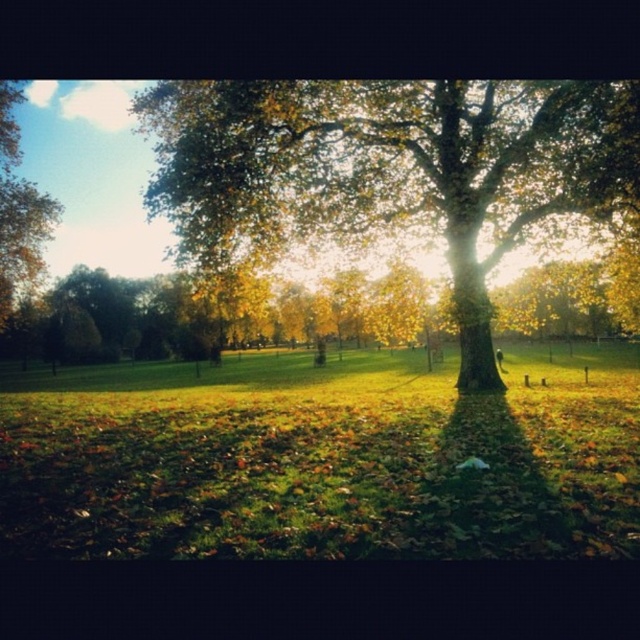
Who is lower down, green grass at center or golden textured tree at center?

Positioned lower is green grass at center.

Between green grass at center and golden textured tree at center, which one appears on the right side from the viewer's perspective?

golden textured tree at center is more to the right.

Does point (129, 435) come in front of point (486, 156)?

Yes, it is in front of point (486, 156).

Identify the location of green grass at center. The height and width of the screenshot is (640, 640). (321, 458).

Who is higher up, green grass at center or green leafy tree at upper left?

green leafy tree at upper left is above.

This screenshot has height=640, width=640. What do you see at coordinates (321, 458) in the screenshot? I see `green grass at center` at bounding box center [321, 458].

Find the location of `green grass at center`. green grass at center is located at coordinates (321, 458).

The height and width of the screenshot is (640, 640). Identify the location of green grass at center. (321, 458).

Does golden textured tree at center appear on the right side of green leafy tree at upper left?

Indeed, golden textured tree at center is positioned on the right side of green leafy tree at upper left.

Based on the photo, can you confirm if golden textured tree at center is positioned below green leafy tree at upper left?

Yes.

Which is behind, point (339, 177) or point (8, 188)?

Positioned behind is point (8, 188).

The image size is (640, 640). Find the location of `golden textured tree at center`. golden textured tree at center is located at coordinates (388, 168).